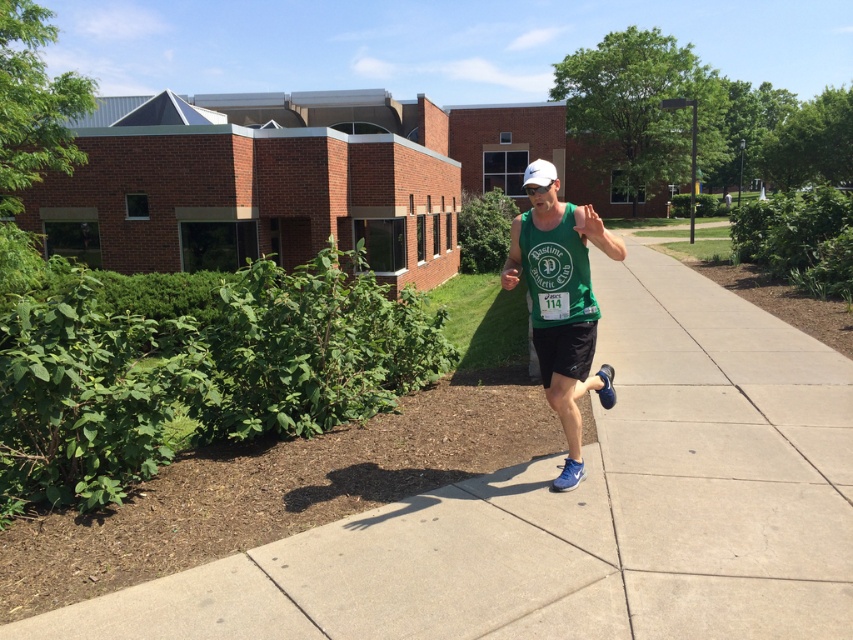
Between point (727, 470) and point (577, 378), which one is positioned behind?

The point (727, 470) is behind.

Can you confirm if gray concrete sidewalk at center is thinner than green fabric tank top at center?

Incorrect, gray concrete sidewalk at center's width is not less than green fabric tank top at center's.

Is point (828, 588) closer to viewer compared to point (531, 241)?

Yes, point (828, 588) is in front of point (531, 241).

The width and height of the screenshot is (853, 640). Identify the location of gray concrete sidewalk at center. (579, 508).